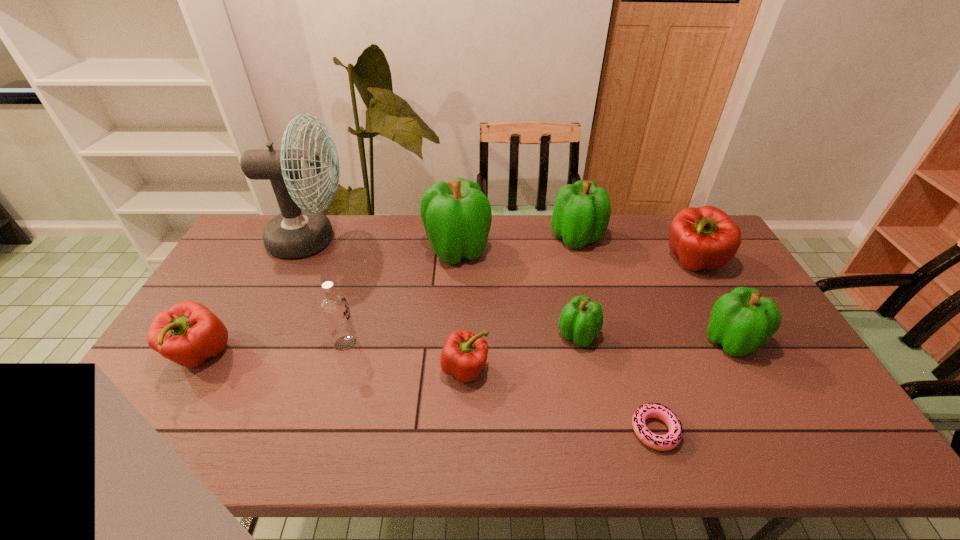
Locate an element on the screen. Image resolution: width=960 pixels, height=540 pixels. empty space between the leftmost pink bell pepper and the fan is located at coordinates (255, 298).

Identify the location of free space between the smallest pink bell pepper and the tallest bell pepper. Image resolution: width=960 pixels, height=540 pixels. (462, 309).

Select which object is the second closest to the smallest green bell pepper. Please provide its 2D coordinates. Your answer should be formatted as a tuple, i.e. [(x, y)], where the tuple contains the x and y coordinates of a point satisfying the conditions above.

[(464, 354)]

Point out which object is positioned as the second nearest to the vodka. Please provide its 2D coordinates. Your answer should be formatted as a tuple, i.e. [(x, y)], where the tuple contains the x and y coordinates of a point satisfying the conditions above.

[(188, 333)]

Find the location of a particular element. the fifth closest bell pepper relative to the smallest pink bell pepper is located at coordinates (741, 321).

Select which bell pepper is the closest to the tallest object. Please provide its 2D coordinates. Your answer should be formatted as a tuple, i.e. [(x, y)], where the tuple contains the x and y coordinates of a point satisfying the conditions above.

[(457, 216)]

This screenshot has height=540, width=960. What are the coordinates of `green bell pepper that stands as the third closest to the smallest green bell pepper` in the screenshot? It's located at coord(581,214).

Identify which green bell pepper is the second nearest to the tallest bell pepper. Please provide its 2D coordinates. Your answer should be formatted as a tuple, i.e. [(x, y)], where the tuple contains the x and y coordinates of a point satisfying the conditions above.

[(581, 320)]

Identify which pink bell pepper is the second nearest to the second pink bell pepper from right to left. Please provide its 2D coordinates. Your answer should be formatted as a tuple, i.e. [(x, y)], where the tuple contains the x and y coordinates of a point satisfying the conditions above.

[(705, 237)]

Point out which pink bell pepper is positioned as the third nearest to the third smallest green bell pepper. Please provide its 2D coordinates. Your answer should be formatted as a tuple, i.e. [(x, y)], where the tuple contains the x and y coordinates of a point satisfying the conditions above.

[(188, 333)]